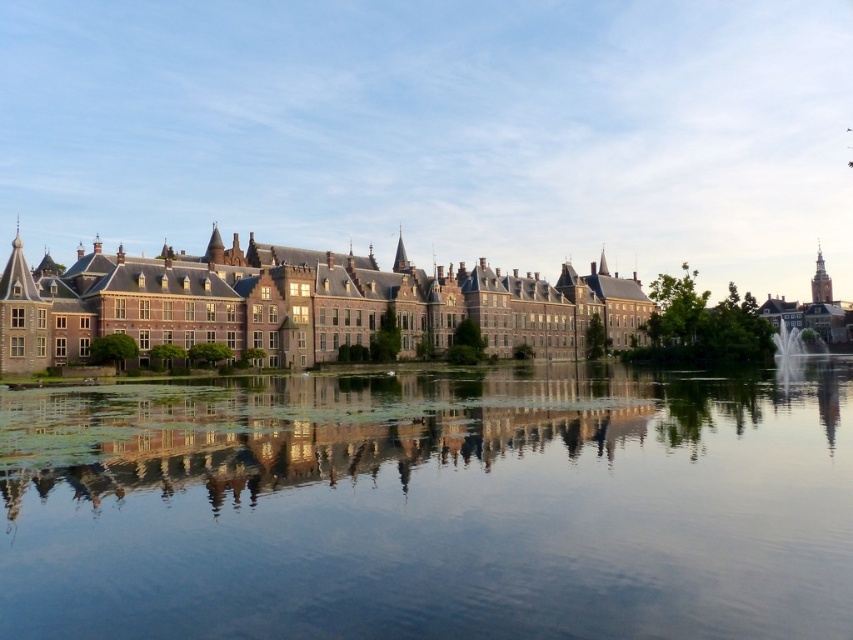
Who is more distant from viewer, (380, 604) or (602, 296)?

Positioned behind is point (602, 296).

Does transparent glass water at center have a lesser width compared to brick stone palace at center?

Indeed, transparent glass water at center has a lesser width compared to brick stone palace at center.

Image resolution: width=853 pixels, height=640 pixels. Identify the location of transparent glass water at center. (434, 508).